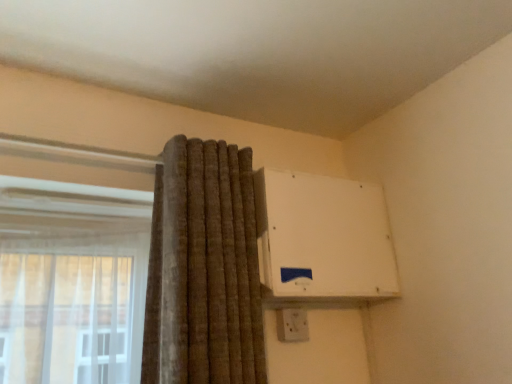
Question: From a real-world perspective, is white plastic air conditioning unit at upper right physically located above or below white plastic electric outlet at upper right?

Choices:
 (A) above
 (B) below

Answer: (A)

Question: Based on their positions, is white plastic air conditioning unit at upper right located to the left or right of white plastic electric outlet at upper right?

Choices:
 (A) left
 (B) right

Answer: (B)

Question: From the image's perspective, is white plastic air conditioning unit at upper right above or below white plastic electric outlet at upper right?

Choices:
 (A) below
 (B) above

Answer: (B)

Question: In the image, is white plastic electric outlet at upper right positioned in front of or behind white plastic air conditioning unit at upper right?

Choices:
 (A) front
 (B) behind

Answer: (B)

Question: Is white plastic electric outlet at upper right to the left or to the right of white plastic air conditioning unit at upper right in the image?

Choices:
 (A) right
 (B) left

Answer: (B)

Question: From a real-world perspective, is white plastic electric outlet at upper right physically located above or below white plastic air conditioning unit at upper right?

Choices:
 (A) below
 (B) above

Answer: (A)

Question: Considering the positions of white plastic electric outlet at upper right and white plastic air conditioning unit at upper right in the image, is white plastic electric outlet at upper right wider or thinner than white plastic air conditioning unit at upper right?

Choices:
 (A) wide
 (B) thin

Answer: (B)